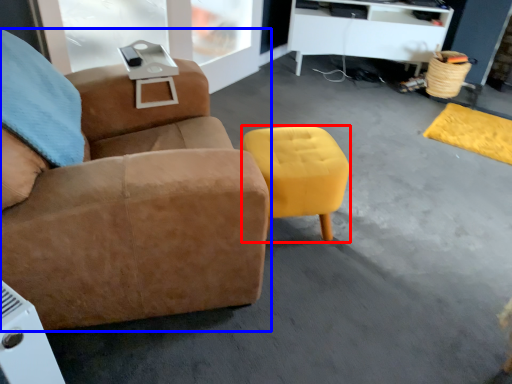
Question: Which of the following is the farthest to the observer, stool (highlighted by a red box) or chair (highlighted by a blue box)?

Choices:
 (A) stool
 (B) chair

Answer: (A)